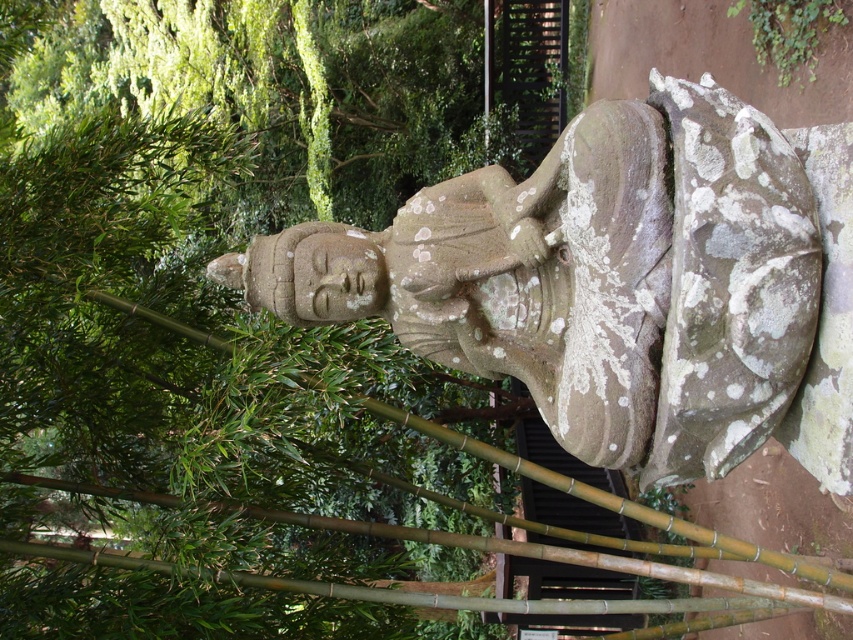
Question: Which object is farther from the camera taking this photo?

Choices:
 (A) stone statue at center
 (B) green bamboo at center

Answer: (B)

Question: Can you confirm if stone statue at center is bigger than green mossy vine at upper right?

Choices:
 (A) yes
 (B) no

Answer: (A)

Question: Observing the image, what is the correct spatial positioning of green bamboo at center in reference to green mossy vine at upper right?

Choices:
 (A) left
 (B) right

Answer: (A)

Question: From the image, what is the correct spatial relationship of stone statue at center in relation to green mossy vine at upper right?

Choices:
 (A) above
 (B) below

Answer: (B)

Question: Which point is closer to the camera?

Choices:
 (A) stone statue at center
 (B) green bamboo at center
 (C) green mossy vine at upper right

Answer: (A)

Question: Based on their relative distances, which object is farther from the green bamboo at center?

Choices:
 (A) stone statue at center
 (B) green mossy vine at upper right

Answer: (B)